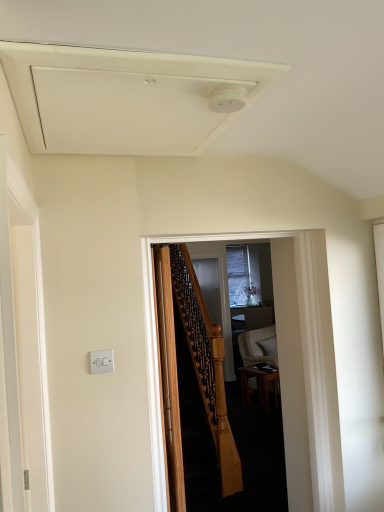
Question: Is white plastic switch at left, which is the second screen door from back to front, oriented towards wooden door at center?

Choices:
 (A) no
 (B) yes

Answer: (A)

Question: Is white plastic switch at left, which is the first screen door in left-to-right order, positioned behind wooden door at center?

Choices:
 (A) no
 (B) yes

Answer: (A)

Question: From the image's perspective, is white plastic switch at left, which is the second screen door from back to front, under wooden door at center?

Choices:
 (A) no
 (B) yes

Answer: (A)

Question: From the image's perspective, does white plastic switch at left, which is counted as the 1th screen door, starting from the front, appear higher than wooden door at center?

Choices:
 (A) yes
 (B) no

Answer: (A)

Question: Considering the relative sizes of white plastic switch at left, which is the first screen door in left-to-right order, and wooden door at center in the image provided, is white plastic switch at left, which is the first screen door in left-to-right order, smaller than wooden door at center?

Choices:
 (A) yes
 (B) no

Answer: (B)

Question: Does white plastic switch at left, which appears as the 2th screen door when viewed from the right, have a greater height compared to wooden door at center?

Choices:
 (A) no
 (B) yes

Answer: (A)

Question: Would you say wooden table at center contains white plastic switch at lower left?

Choices:
 (A) yes
 (B) no

Answer: (B)

Question: From a real-world perspective, is wooden table at center located beneath white plastic switch at lower left?

Choices:
 (A) yes
 (B) no

Answer: (A)

Question: Is the position of wooden table at center less distant than that of white plastic switch at lower left?

Choices:
 (A) no
 (B) yes

Answer: (A)

Question: Considering the relative sizes of wooden table at center and white plastic switch at lower left in the image provided, is wooden table at center wider than white plastic switch at lower left?

Choices:
 (A) no
 (B) yes

Answer: (B)

Question: Are wooden table at center and white plastic switch at lower left located far from each other?

Choices:
 (A) yes
 (B) no

Answer: (A)

Question: Is wooden table at center outside white plastic switch at lower left?

Choices:
 (A) no
 (B) yes

Answer: (B)

Question: Is wooden table at center facing towards clear glass screen door at center, acting as the first screen door starting from the right?

Choices:
 (A) no
 (B) yes

Answer: (A)